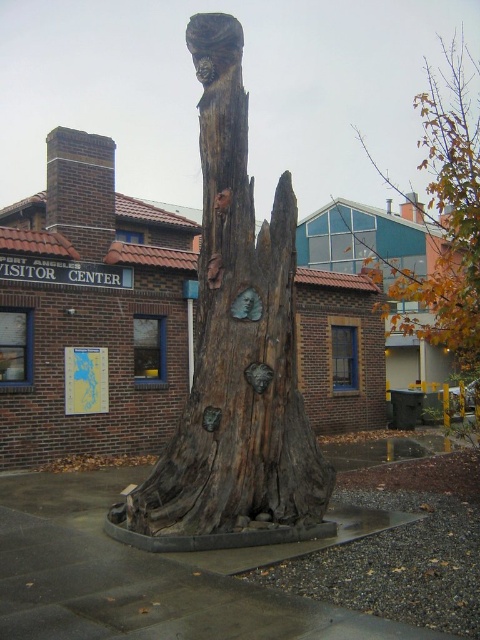
Question: Which of the following is the farthest from the observer?

Choices:
 (A) weathered wood tree trunk at center
 (B) brown wood tree trunk at upper right

Answer: (B)

Question: Which object is farther from the camera taking this photo?

Choices:
 (A) brown wood tree trunk at upper right
 (B) weathered wood tree trunk at center

Answer: (A)

Question: Does weathered wood tree trunk at center appear under brown wood tree trunk at upper right?

Choices:
 (A) no
 (B) yes

Answer: (B)

Question: Observing the image, what is the correct spatial positioning of weathered wood tree trunk at center in reference to brown wood tree trunk at upper right?

Choices:
 (A) above
 (B) below

Answer: (B)

Question: Considering the relative positions of weathered wood tree trunk at center and brown wood tree trunk at upper right in the image provided, where is weathered wood tree trunk at center located with respect to brown wood tree trunk at upper right?

Choices:
 (A) right
 (B) left

Answer: (B)